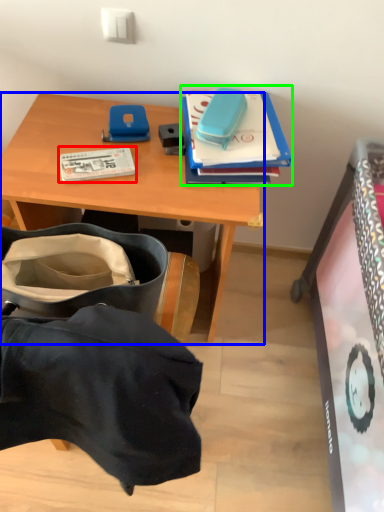
Question: Which is nearer to the book (highlighted by a red box)? desk (highlighted by a blue box) or book (highlighted by a green box).

Choices:
 (A) desk
 (B) book

Answer: (A)